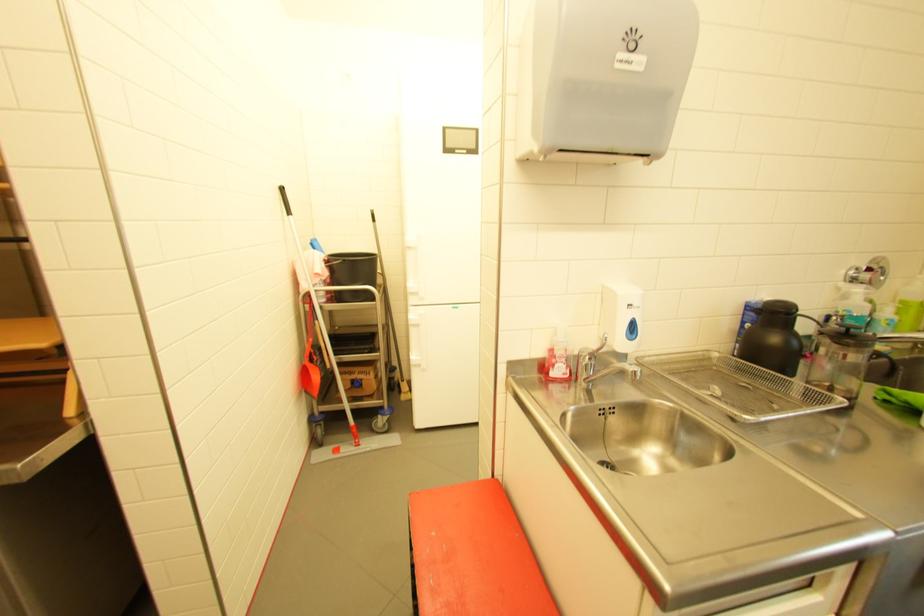
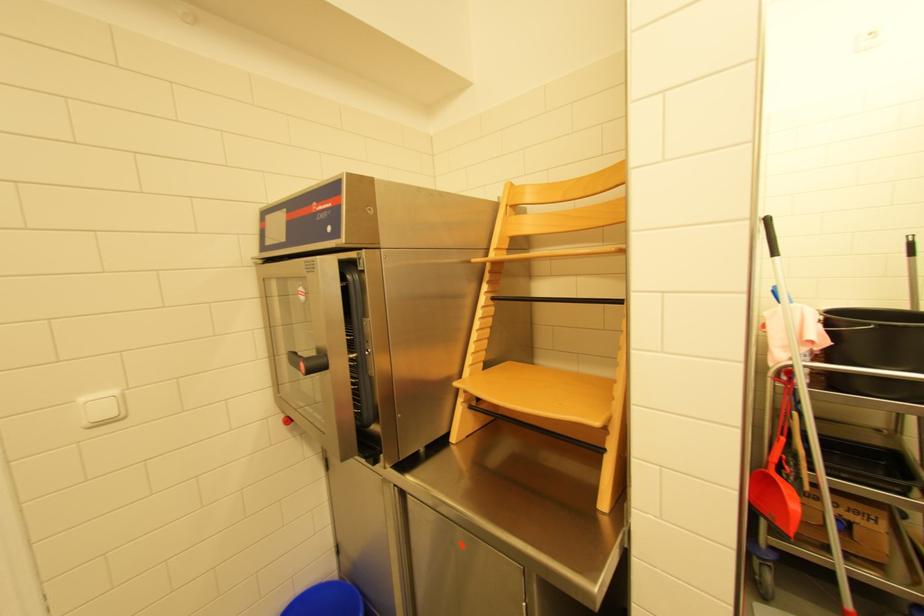
In the second image, find the point that corresponds to pixel 315 310 in the first image.

(787, 391)